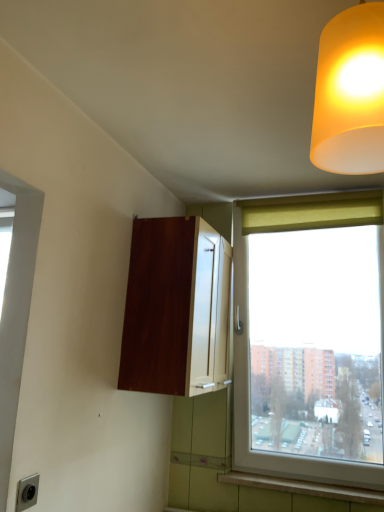
The height and width of the screenshot is (512, 384). I want to click on matte yellow lampshade at upper right, so click(350, 93).

Where is `electric outlet located on the left of matte yellow curtain at upper right`? electric outlet located on the left of matte yellow curtain at upper right is located at coordinates (27, 492).

Is matte gray electric outlet at lower left turned away from matte yellow curtain at upper right?

No, matte gray electric outlet at lower left is not facing away from matte yellow curtain at upper right.

Can you confirm if matte gray electric outlet at lower left is positioned to the left of matte yellow curtain at upper right?

Yes, matte gray electric outlet at lower left is to the left of matte yellow curtain at upper right.

From the image's perspective, is mahogany wood cabinet at center positioned above or below matte yellow lampshade at upper right?

From the image's perspective, mahogany wood cabinet at center appears below matte yellow lampshade at upper right.

Looking at this image, is mahogany wood cabinet at center looking in the opposite direction of matte yellow lampshade at upper right?

No.

From a real-world perspective, is mahogany wood cabinet at center positioned above or below matte yellow lampshade at upper right?

From a real-world perspective, mahogany wood cabinet at center is physically below matte yellow lampshade at upper right.

Relative to matte yellow lampshade at upper right, is mahogany wood cabinet at center in front or behind?

Clearly, mahogany wood cabinet at center is behind matte yellow lampshade at upper right.

Between matte yellow lampshade at upper right and mahogany wood cabinet at center, which one appears on the left side from the viewer's perspective?

mahogany wood cabinet at center.

Between matte yellow lampshade at upper right and mahogany wood cabinet at center, which one has more height?

With more height is mahogany wood cabinet at center.

Which point is more distant from viewer, (376, 153) or (204, 256)?

The point (204, 256) is more distant.

From a real-world perspective, which is physically above, mahogany wood cabinet at center or matte yellow curtain at upper right?

matte yellow curtain at upper right is physically above.

Is mahogany wood cabinet at center taller than matte yellow curtain at upper right?

Indeed, mahogany wood cabinet at center has a greater height compared to matte yellow curtain at upper right.

Is mahogany wood cabinet at center inside or outside of matte yellow curtain at upper right?

mahogany wood cabinet at center cannot be found inside matte yellow curtain at upper right.

From the image's perspective, relative to mahogany wood cabinet at center, is wooden window sill at lower right above or below?

Based on their image positions, wooden window sill at lower right is located beneath mahogany wood cabinet at center.

In the scene shown: Is wooden window sill at lower right not near mahogany wood cabinet at center?

They are positioned close to each other.

Is wooden window sill at lower right smaller than mahogany wood cabinet at center?

Correct, wooden window sill at lower right occupies less space than mahogany wood cabinet at center.

Which is more to the right, wooden window sill at lower right or matte yellow lampshade at upper right?

wooden window sill at lower right is more to the right.

Is wooden window sill at lower right outside of matte yellow lampshade at upper right?

That's correct, wooden window sill at lower right is outside of matte yellow lampshade at upper right.

How many degrees apart are the facing directions of wooden window sill at lower right and matte yellow lampshade at upper right?

The angle between the facing direction of wooden window sill at lower right and the facing direction of matte yellow lampshade at upper right is 91.7 degrees.

From the picture: Does wooden window sill at lower right turn towards matte yellow lampshade at upper right?

No, wooden window sill at lower right is not turned towards matte yellow lampshade at upper right.

Is matte yellow lampshade at upper right not inside matte yellow curtain at upper right?

Yes, matte yellow lampshade at upper right is located beyond the bounds of matte yellow curtain at upper right.

How much distance is there between matte yellow lampshade at upper right and matte yellow curtain at upper right?

The distance of matte yellow lampshade at upper right from matte yellow curtain at upper right is 1.36 meters.

Is matte yellow lampshade at upper right positioned in front of matte yellow curtain at upper right?

Yes, matte yellow lampshade at upper right is closer to the camera.

Locate an element on the screen. The image size is (384, 512). curtain that is above the matte yellow lampshade at upper right (from a real-world perspective) is located at coordinates (311, 211).

I want to click on electric outlet located underneath the matte yellow curtain at upper right (from a real-world perspective), so click(27, 492).

Where is `lamp located above the mahogany wood cabinet at center (from the image's perspective)`? This screenshot has height=512, width=384. lamp located above the mahogany wood cabinet at center (from the image's perspective) is located at coordinates (350, 93).

Which object lies nearer to the anchor point mahogany wood cabinet at center, matte gray electric outlet at lower left or wooden window sill at lower right?

matte gray electric outlet at lower left lies closer to mahogany wood cabinet at center than the other object.

Estimate the real-world distances between objects in this image. Which object is closer to matte yellow curtain at upper right, matte gray electric outlet at lower left or mahogany wood cabinet at center?

mahogany wood cabinet at center lies closer to matte yellow curtain at upper right than the other object.

Estimate the real-world distances between objects in this image. Which object is further from matte yellow lampshade at upper right, matte yellow curtain at upper right or matte gray electric outlet at lower left?

The object further to matte yellow lampshade at upper right is matte yellow curtain at upper right.

From the image, which object appears to be nearer to matte gray electric outlet at lower left, mahogany wood cabinet at center or wooden window sill at lower right?

Based on the image, mahogany wood cabinet at center appears to be nearer to matte gray electric outlet at lower left.

From the image, which object appears to be farther from matte yellow lampshade at upper right, matte yellow curtain at upper right or mahogany wood cabinet at center?

matte yellow curtain at upper right is positioned further to the anchor matte yellow lampshade at upper right.

Based on their spatial positions, is matte yellow lampshade at upper right or mahogany wood cabinet at center closer to matte yellow curtain at upper right?

mahogany wood cabinet at center is positioned closer to the anchor matte yellow curtain at upper right.

From the image, which object appears to be farther from matte yellow lampshade at upper right, matte gray electric outlet at lower left or mahogany wood cabinet at center?

Among the two, matte gray electric outlet at lower left is located further to matte yellow lampshade at upper right.

When comparing their distances from wooden window sill at lower right, does mahogany wood cabinet at center or matte gray electric outlet at lower left seem closer?

Among the two, mahogany wood cabinet at center is located nearer to wooden window sill at lower right.

Where is `cabinetry between matte gray electric outlet at lower left and wooden window sill at lower right from left to right`? The height and width of the screenshot is (512, 384). cabinetry between matte gray electric outlet at lower left and wooden window sill at lower right from left to right is located at coordinates (177, 309).

Locate an element on the screen. This screenshot has height=512, width=384. cabinetry between matte yellow curtain at upper right and wooden window sill at lower right in the vertical direction is located at coordinates (177, 309).

Locate an element on the screen. The height and width of the screenshot is (512, 384). cabinetry positioned between matte yellow lampshade at upper right and matte yellow curtain at upper right from near to far is located at coordinates (177, 309).

Locate an element on the screen. This screenshot has width=384, height=512. electric outlet positioned between matte yellow lampshade at upper right and matte yellow curtain at upper right from near to far is located at coordinates (27, 492).